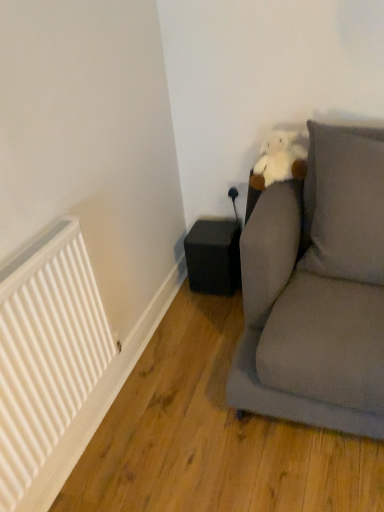
Question: Is white matte radiator at left closer to the viewer compared to black matte speaker at lower center?

Choices:
 (A) no
 (B) yes

Answer: (B)

Question: Is white matte radiator at left at the right side of black matte speaker at lower center?

Choices:
 (A) no
 (B) yes

Answer: (A)

Question: Considering the relative sizes of white matte radiator at left and black matte speaker at lower center in the image provided, is white matte radiator at left taller than black matte speaker at lower center?

Choices:
 (A) no
 (B) yes

Answer: (B)

Question: From the image's perspective, is white matte radiator at left over black matte speaker at lower center?

Choices:
 (A) yes
 (B) no

Answer: (B)

Question: From a real-world perspective, is white matte radiator at left physically above black matte speaker at lower center?

Choices:
 (A) no
 (B) yes

Answer: (B)

Question: From the image's perspective, is white matte radiator at left located beneath black matte speaker at lower center?

Choices:
 (A) yes
 (B) no

Answer: (A)

Question: From the image's perspective, is gray fabric pillow at upper right below black matte speaker at lower center?

Choices:
 (A) no
 (B) yes

Answer: (A)

Question: From a real-world perspective, does gray fabric pillow at upper right stand above black matte speaker at lower center?

Choices:
 (A) no
 (B) yes

Answer: (B)

Question: Would you say black matte speaker at lower center is part of gray fabric pillow at upper right's contents?

Choices:
 (A) no
 (B) yes

Answer: (A)

Question: From the image's perspective, is gray fabric pillow at upper right on top of black matte speaker at lower center?

Choices:
 (A) yes
 (B) no

Answer: (A)

Question: Is gray fabric pillow at upper right not close to black matte speaker at lower center?

Choices:
 (A) yes
 (B) no

Answer: (B)

Question: Can we say gray fabric pillow at upper right lies outside black matte speaker at lower center?

Choices:
 (A) yes
 (B) no

Answer: (A)

Question: From a real-world perspective, is white matte radiator at left on gray fabric pillow at upper right?

Choices:
 (A) yes
 (B) no

Answer: (B)